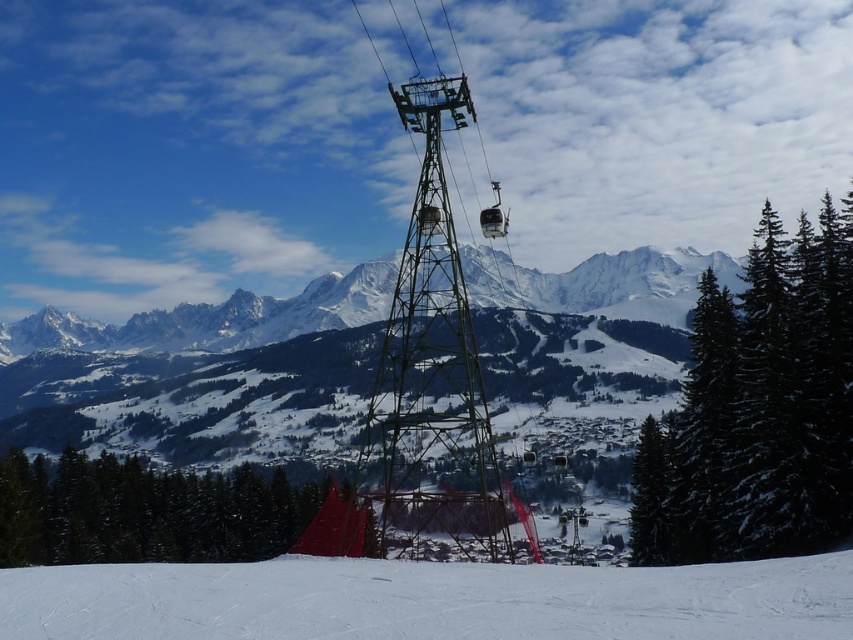
Question: Which point is farther from the camera taking this photo?

Choices:
 (A) (585, 570)
 (B) (705, 387)
 (C) (442, 83)

Answer: (B)

Question: Which point appears closest to the camera in this image?

Choices:
 (A) (428, 106)
 (B) (56, 472)
 (C) (822, 376)

Answer: (C)

Question: Estimate the real-world distances between objects in this image. Which object is farther from the green metallic tower at center?

Choices:
 (A) green textured pine trees at right
 (B) white snow at center
 (C) green matte tent at lower left

Answer: (B)

Question: Is white snow at center below green matte tent at lower left?

Choices:
 (A) no
 (B) yes

Answer: (A)

Question: Is green textured pine trees at right in front of green matte tent at lower left?

Choices:
 (A) yes
 (B) no

Answer: (A)

Question: Does white snow at center come in front of green metallic tower at center?

Choices:
 (A) no
 (B) yes

Answer: (B)